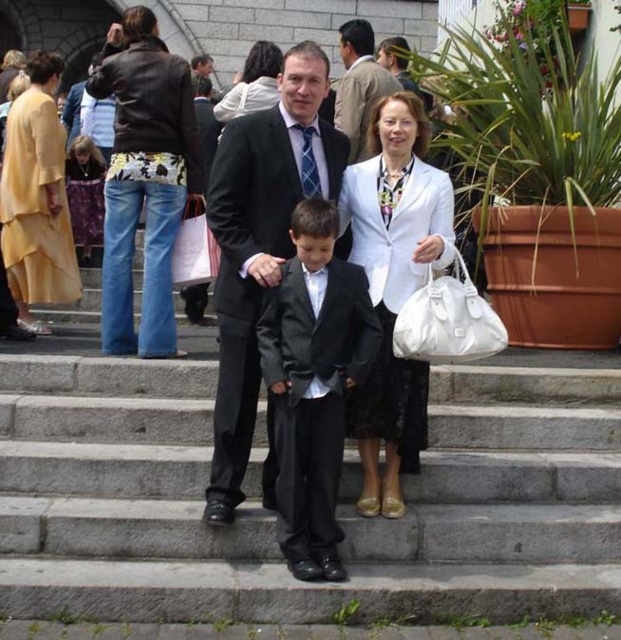
Between point (107, 216) and point (265, 93), which one is positioned behind?

Point (265, 93)

This screenshot has height=640, width=621. Describe the element at coordinates (143, 180) in the screenshot. I see `leather jacket at upper left` at that location.

The image size is (621, 640). Find the location of `leather jacket at upper left`. leather jacket at upper left is located at coordinates (143, 180).

Between white satin blazer at center and leather jacket at upper left, which one appears on the right side from the viewer's perspective?

From the viewer's perspective, white satin blazer at center appears more on the right side.

Between white satin blazer at center and leather jacket at upper left, which one has more height?

Standing taller between the two is leather jacket at upper left.

Find the location of a particular element. This screenshot has height=640, width=621. white satin blazer at center is located at coordinates (392, 284).

Between point (224, 323) and point (388, 438), which one is positioned in front?

Point (388, 438) is more forward.

Can you confirm if black satin suit at center is positioned below white satin blazer at center?

No, black satin suit at center is not below white satin blazer at center.

Which is in front, point (245, 208) or point (404, 188)?

Point (245, 208)

Identify the location of black satin suit at center. The image size is (621, 640). (260, 243).